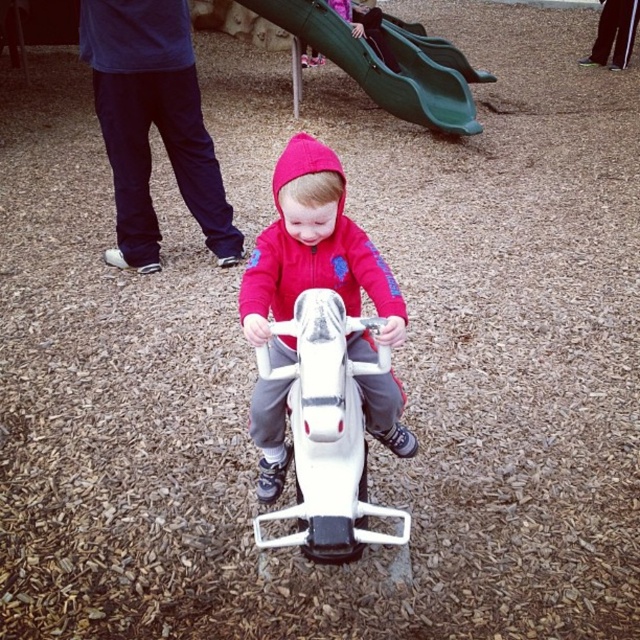
Question: Does matte pink hoodie at center lie behind green plastic slide at upper center?

Choices:
 (A) yes
 (B) no

Answer: (B)

Question: Which point is closer to the camera taking this photo?

Choices:
 (A) (438, 76)
 (B) (346, 384)

Answer: (B)

Question: Which object is closer to the camera taking this photo?

Choices:
 (A) green plastic slide at upper center
 (B) matte pink hoodie at center
 (C) white plastic toy car at center

Answer: (C)

Question: Is white plastic toy car at center positioned behind green plastic slide at upper center?

Choices:
 (A) no
 (B) yes

Answer: (A)

Question: Can you confirm if white plastic toy car at center is bigger than green plastic slide at upper center?

Choices:
 (A) no
 (B) yes

Answer: (A)

Question: Which point appears closest to the camera in this image?

Choices:
 (A) (310, 8)
 (B) (250, 292)

Answer: (B)